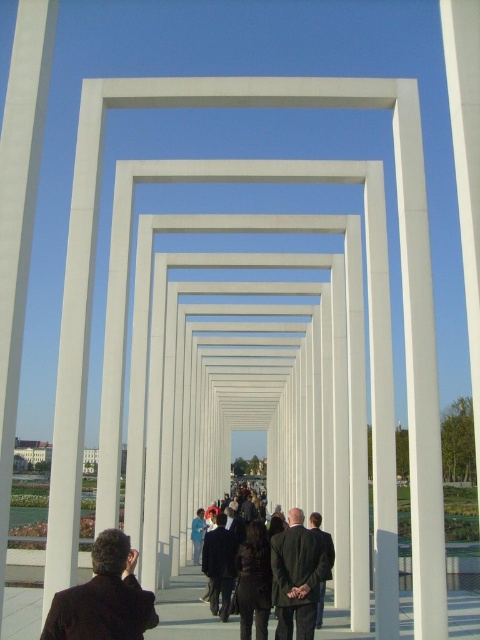
From the picture: Measure the distance between point (307, 605) and camera.

The distance of point (307, 605) from camera is 13.48 meters.

Does dark suit at center have a larger size compared to dark gray suit at center?

Actually, dark suit at center might be smaller than dark gray suit at center.

Where is `dark suit at center`? dark suit at center is located at coordinates (299, 573).

The height and width of the screenshot is (640, 480). Identify the location of dark suit at center. [299, 573].

Who is more distant from viewer, (146, 604) or (285, 637)?

The point (285, 637) is behind.

Between dark brown suit at center and dark gray suit at center, which one appears on the right side from the viewer's perspective?

dark gray suit at center is more to the right.

Between point (123, 573) and point (308, 596), which one is positioned in front?

Point (123, 573) is in front.

Identify the location of dark brown suit at center. This screenshot has height=640, width=480. (104, 596).

Does dark brown suit at center have a greater width compared to dark suit at center?

Yes, dark brown suit at center is wider than dark suit at center.

The width and height of the screenshot is (480, 640). Describe the element at coordinates (104, 596) in the screenshot. I see `dark brown suit at center` at that location.

Locate an element on the screen. dark brown suit at center is located at coordinates (104, 596).